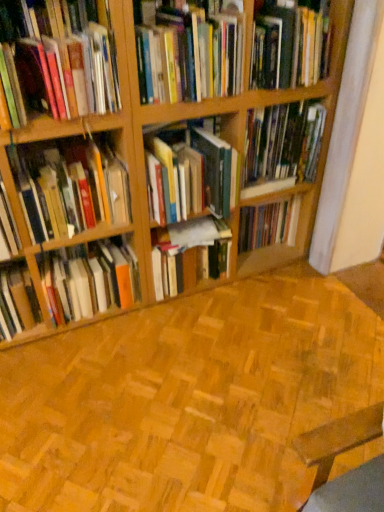
What is the approximate height of hardcover books at center, the 1th book positioned from the bottom?

13.91 inches.

Measure the distance between point (128, 300) and camera.

A distance of 5.82 feet exists between point (128, 300) and camera.

This screenshot has width=384, height=512. What do you see at coordinates (57, 59) in the screenshot?
I see `matte hardcover books at upper left, which appears as the 7th book when ordered from the bottom` at bounding box center [57, 59].

In order to face hardcover book at upper right, acting as the first book starting from the top, should I rotate leftwards or rightwards?

Turn right by 11.344 degrees to look at hardcover book at upper right, acting as the first book starting from the top.

Consider the image. Measure the distance between point (251, 194) and camera.

Point (251, 194) is 5.69 feet from camera.

The image size is (384, 512). In order to click on hardcover book at upper center, which is the 8th book in bottom-to-top order in this screenshot , I will do `click(189, 56)`.

This screenshot has width=384, height=512. Identify the location of hardcover book at center, which is the 7th book from top to bottom. (268, 224).

Can you confirm if matte hardcover books at upper left, which appears as the 7th book when ordered from the bottom, is taller than hardcover books at left, which is the 4th book from bottom to top?

Yes.

Can hardcover books at left, which is the 4th book from bottom to top, be found inside matte hardcover books at upper left, which appears as the 7th book when ordered from the bottom?

No, hardcover books at left, which is the 4th book from bottom to top, is located outside of matte hardcover books at upper left, which appears as the 7th book when ordered from the bottom.

Which of these two, matte hardcover books at upper left, which appears as the 7th book when ordered from the bottom, or hardcover books at left, the sixth book positioned from the top, is bigger?

matte hardcover books at upper left, which appears as the 7th book when ordered from the bottom, is bigger.

From a real-world perspective, is matte hardcover books at upper left, which ranks as the third book in top-to-bottom order, below hardcover books at left, the sixth book positioned from the top?

Actually, matte hardcover books at upper left, which ranks as the third book in top-to-bottom order, is physically above hardcover books at left, the sixth book positioned from the top, in the real world.

Is point (273, 28) positioned after point (164, 294)?

No, it is not.

Which object is thinner, hardcover book at upper right, acting as the 9th book starting from the bottom, or hardcover book at center, positioned as the eighth book in top-to-bottom order?

Thinner between the two is hardcover book at center, positioned as the eighth book in top-to-bottom order.

How far apart are hardcover book at upper right, acting as the 9th book starting from the bottom, and hardcover book at center, which appears as the second book when ordered from the bottom?

hardcover book at upper right, acting as the 9th book starting from the bottom, and hardcover book at center, which appears as the second book when ordered from the bottom, are 27.11 inches apart from each other.

Looking at the image, does hardcover book at upper right, acting as the first book starting from the top, seem bigger or smaller compared to hardcover book at center, positioned as the eighth book in top-to-bottom order?

Considering their sizes, hardcover book at upper right, acting as the first book starting from the top, takes up more space than hardcover book at center, positioned as the eighth book in top-to-bottom order.

Is wooden parquet flooring at center completely or partially outside of hardcover book at center, which is the 7th book from top to bottom?

Yes.

Are wooden parquet flooring at center and hardcover book at center, which is the 7th book from top to bottom, far apart?

No.

Who is taller, wooden parquet flooring at center or hardcover book at center, which is the 7th book from top to bottom?

hardcover book at center, which is the 7th book from top to bottom, is taller.

In the image, is wooden parquet flooring at center on the left side or the right side of hardcover book at center, which is the 7th book from top to bottom?

From the image, it's evident that wooden parquet flooring at center is to the left of hardcover book at center, which is the 7th book from top to bottom.

Is hardcover books at center, which is counted as the 9th book, starting from the top, taller than hardcover book at upper right, acting as the first book starting from the top?

Correct, hardcover books at center, which is counted as the 9th book, starting from the top, is much taller as hardcover book at upper right, acting as the first book starting from the top.

Which of these two, hardcover books at center, the 1th book positioned from the bottom, or hardcover book at upper right, acting as the 9th book starting from the bottom, is thinner?

hardcover books at center, the 1th book positioned from the bottom.

From a real-world perspective, is hardcover books at center, which is counted as the 9th book, starting from the top, physically located above or below hardcover book at upper right, acting as the first book starting from the top?

Clearly, from a real-world perspective, hardcover books at center, which is counted as the 9th book, starting from the top, is below hardcover book at upper right, acting as the first book starting from the top.

Is hardcover books at left, the sixth book positioned from the top, shorter than hardcover books at center, the 1th book positioned from the bottom?

Correct, hardcover books at left, the sixth book positioned from the top, is not as tall as hardcover books at center, the 1th book positioned from the bottom.

Between hardcover books at left, which is the 4th book from bottom to top, and hardcover books at center, the 1th book positioned from the bottom, which one has smaller size?

Smaller between the two is hardcover books at left, which is the 4th book from bottom to top.

Can you confirm if hardcover books at left, the sixth book positioned from the top, is wider than hardcover books at center, the 1th book positioned from the bottom?

In fact, hardcover books at left, the sixth book positioned from the top, might be narrower than hardcover books at center, the 1th book positioned from the bottom.

Which is closer to the camera, [37,165] or [100,285]?

Point [37,165] appears to be closer to the viewer than point [100,285].

Does point (140, 508) come farther from viewer compared to point (290, 74)?

No, it is in front of (290, 74).

Is wooden parquet flooring at center positioned beyond the bounds of hardcover book at upper right, acting as the first book starting from the top?

Yes, wooden parquet flooring at center is located beyond the bounds of hardcover book at upper right, acting as the first book starting from the top.

Consider the image. Is wooden parquet flooring at center aimed at hardcover book at upper right, acting as the first book starting from the top?

No, wooden parquet flooring at center is not aimed at hardcover book at upper right, acting as the first book starting from the top.

From a real-world perspective, is hardcover books at center, which is the 6th book in bottom-to-top order, below wooden parquet flooring at center?

Incorrect, from a real-world perspective, hardcover books at center, which is the 6th book in bottom-to-top order, is higher than wooden parquet flooring at center.

Which object is wider, hardcover books at center, which is counted as the fourth book, starting from the top, or wooden parquet flooring at center?

Wider between the two is wooden parquet flooring at center.

Considering the relative positions of hardcover books at center, which is counted as the fourth book, starting from the top, and wooden parquet flooring at center in the image provided, is hardcover books at center, which is counted as the fourth book, starting from the top, to the right of wooden parquet flooring at center from the viewer's perspective?

Indeed, hardcover books at center, which is counted as the fourth book, starting from the top, is positioned on the right side of wooden parquet flooring at center.

Considering the positions of objects hardcover books at center, which is the 6th book in bottom-to-top order, and wooden parquet flooring at center in the image provided, who is in front, hardcover books at center, which is the 6th book in bottom-to-top order, or wooden parquet flooring at center?

Positioned in front is wooden parquet flooring at center.

Locate an element on the screen. The image size is (384, 512). book that is the 3rd object located in front of the hardcover books at left, which is the 4th book from bottom to top is located at coordinates (57, 59).

Find the location of a particular element. The height and width of the screenshot is (512, 384). book that is the 6th one below the hardcover book at upper right, acting as the 9th book starting from the bottom (from a real-world perspective) is located at coordinates (190, 255).

Which object lies further to the anchor point hardcover books at left, the sixth book positioned from the top, hardcover book at upper right, acting as the 9th book starting from the bottom, or hardcover books at center, which is the 6th book in bottom-to-top order?

hardcover book at upper right, acting as the 9th book starting from the bottom.

Considering their positions, is hardcover books at center, arranged as the fifth book when ordered from the bottom, positioned further to hardcover books at center, which is counted as the fourth book, starting from the top, than hardcover book at center, which appears as the second book when ordered from the bottom?

Among the two, hardcover book at center, which appears as the second book when ordered from the bottom, is located further to hardcover books at center, which is counted as the fourth book, starting from the top.

Based on their spatial positions, is hardcover books at center, which is the 6th book in bottom-to-top order, or hardcover book at center, which appears as the second book when ordered from the bottom, closer to hardcover book at upper right, acting as the first book starting from the top?

The object closer to hardcover book at upper right, acting as the first book starting from the top, is hardcover books at center, which is the 6th book in bottom-to-top order.

Which object lies nearer to the anchor point wooden parquet flooring at center, hardcover books at center, which is counted as the fourth book, starting from the top, or hardcover book at upper center, positioned as the second book in top-to-bottom order?

hardcover books at center, which is counted as the fourth book, starting from the top, lies closer to wooden parquet flooring at center than the other object.

When comparing their distances from hardcover book at center, which appears as the second book when ordered from the bottom, does wooden parquet flooring at center or hardcover books at left, the sixth book positioned from the top, seem further?

hardcover books at left, the sixth book positioned from the top, lies further to hardcover book at center, which appears as the second book when ordered from the bottom, than the other object.

Looking at the image, which one is located further to hardcover books at center, which is counted as the 9th book, starting from the top, hardcover book at center, which is the 3th book in bottom-to-top order, or hardcover book at upper center, which is the 8th book in bottom-to-top order?

hardcover book at center, which is the 3th book in bottom-to-top order, is positioned further to the anchor hardcover books at center, which is counted as the 9th book, starting from the top.

Consider the image. Based on their spatial positions, is hardcover book at center, which is the 7th book from top to bottom, or matte hardcover books at upper left, which appears as the 7th book when ordered from the bottom, further from hardcover books at left, which is the 4th book from bottom to top?

Based on the image, hardcover book at center, which is the 7th book from top to bottom, appears to be further to hardcover books at left, which is the 4th book from bottom to top.

From the picture: Considering their positions, is hardcover books at center, which is the 6th book in bottom-to-top order, positioned closer to hardcover book at upper center, positioned as the second book in top-to-bottom order, than hardcover book at upper right, acting as the first book starting from the top?

hardcover book at upper right, acting as the first book starting from the top, lies closer to hardcover book at upper center, positioned as the second book in top-to-bottom order, than the other object.

Image resolution: width=384 pixels, height=512 pixels. Find the location of `book situated between hardcover book at upper center, which is the 8th book in bottom-to-top order, and hardcover books at center, which is the 6th book in bottom-to-top order, from left to right`. book situated between hardcover book at upper center, which is the 8th book in bottom-to-top order, and hardcover books at center, which is the 6th book in bottom-to-top order, from left to right is located at coordinates (190, 172).